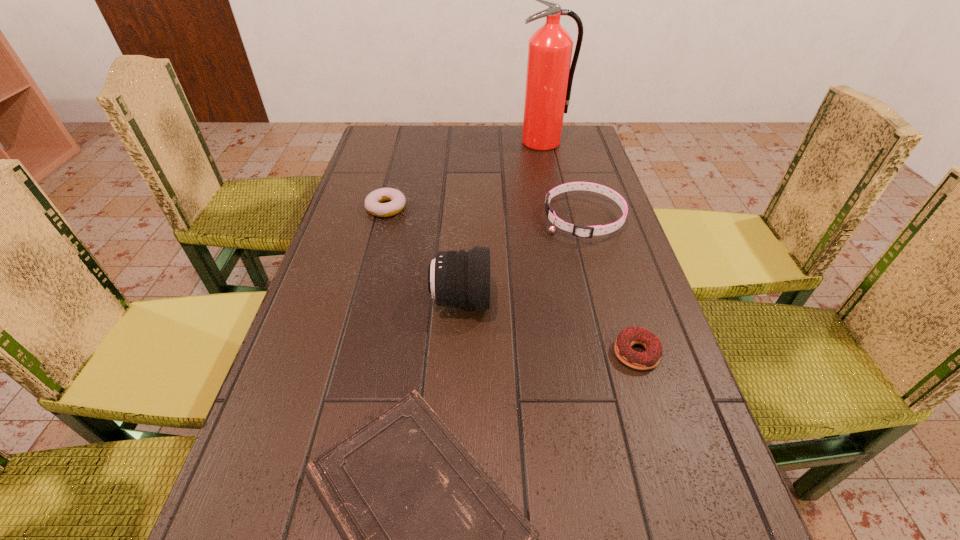
This screenshot has width=960, height=540. Find the location of `free spot located with the buckle on the fourth shortest object`. free spot located with the buckle on the fourth shortest object is located at coordinates (507, 220).

Where is `vacant area situated 0.090m with the buckle on the fourth shortest object`? The height and width of the screenshot is (540, 960). vacant area situated 0.090m with the buckle on the fourth shortest object is located at coordinates (511, 220).

I want to click on vacant area situated with the buckle on the fourth shortest object, so click(x=417, y=220).

Identify the location of vacant space located 0.080m on the front of the left doughnut. Image resolution: width=960 pixels, height=540 pixels. (378, 239).

In order to click on free space located on the front of the nearer doughnut in this screenshot , I will do `click(687, 516)`.

Find the location of `object that is at the far edge`. object that is at the far edge is located at coordinates (549, 77).

Find the location of `object located in the left edge section of the desktop`. object located in the left edge section of the desktop is located at coordinates (373, 204).

Where is `fire extinguisher situated at the right edge`? The height and width of the screenshot is (540, 960). fire extinguisher situated at the right edge is located at coordinates (549, 77).

The width and height of the screenshot is (960, 540). Find the location of `dog collar that is at the right edge`. dog collar that is at the right edge is located at coordinates (581, 231).

Where is `doughnut located at the right edge`? The width and height of the screenshot is (960, 540). doughnut located at the right edge is located at coordinates (648, 359).